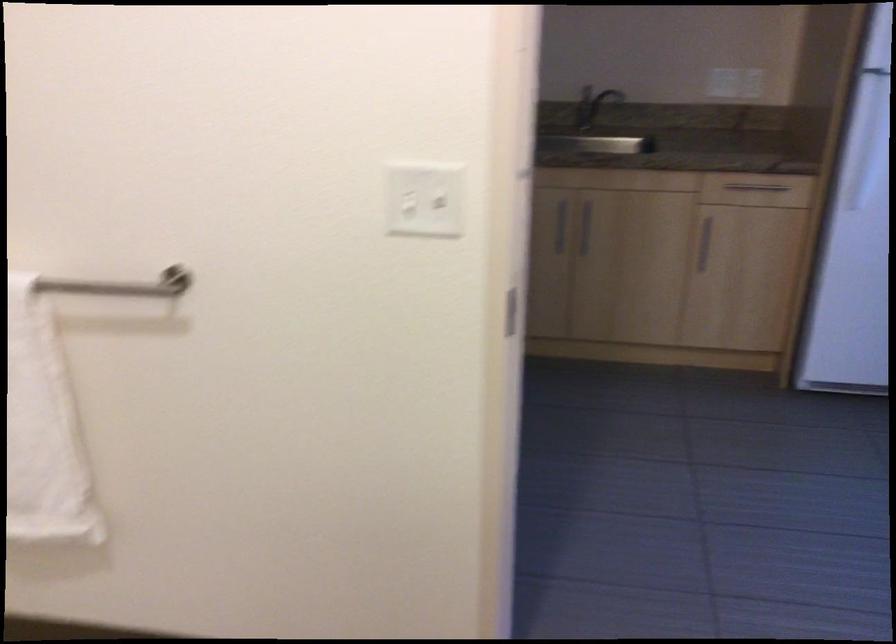
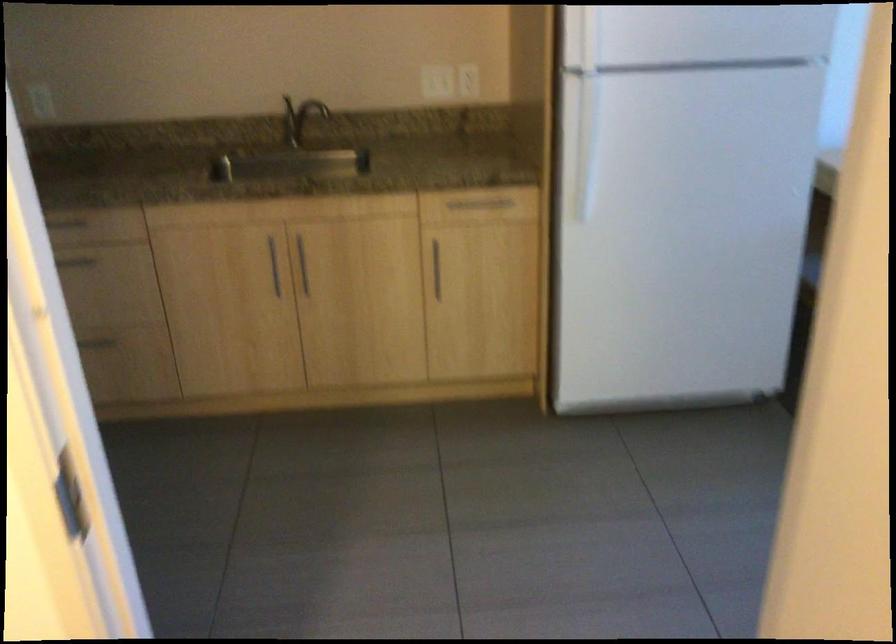
Question: I am providing you with two images of the same scene from different viewpoints. Which of the following objects are not visible in image2?

Choices:
 (A) freezer door handle
 (B) faucet handle
 (C) refrigerator handle
 (D) none of these

Answer: (D)